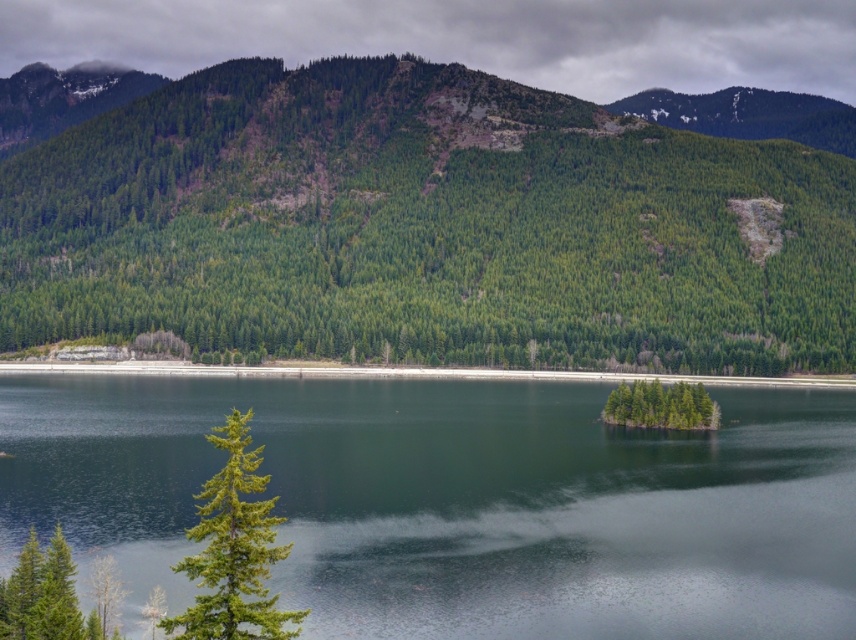
Looking at this image, can you confirm if green matte tree at center is smaller than green textured pine tree at lower left?

Incorrect, green matte tree at center is not smaller in size than green textured pine tree at lower left.

Does point (803, 365) come farther from viewer compared to point (218, 628)?

Yes, it is.

The image size is (856, 640). What are the coordinates of `green matte tree at center` in the screenshot? It's located at (437, 221).

From the picture: Is green matte tree at center smaller than green smooth water at center?

No.

Between green matte tree at center and green smooth water at center, which one is positioned lower?

green smooth water at center is lower down.

Between point (140, 289) and point (563, 580), which one is positioned in front?

Point (563, 580) is in front.

Identify the location of green matte tree at center. (437, 221).

Is green matte tree at center smaller than green matte island at center?

No, green matte tree at center is not smaller than green matte island at center.

Between point (709, 241) and point (669, 388), which one is positioned in front?

Point (669, 388) is more forward.

Between point (795, 150) and point (660, 400), which one is positioned in front?

Point (660, 400)

Where is `green matte tree at center`? The height and width of the screenshot is (640, 856). green matte tree at center is located at coordinates (437, 221).